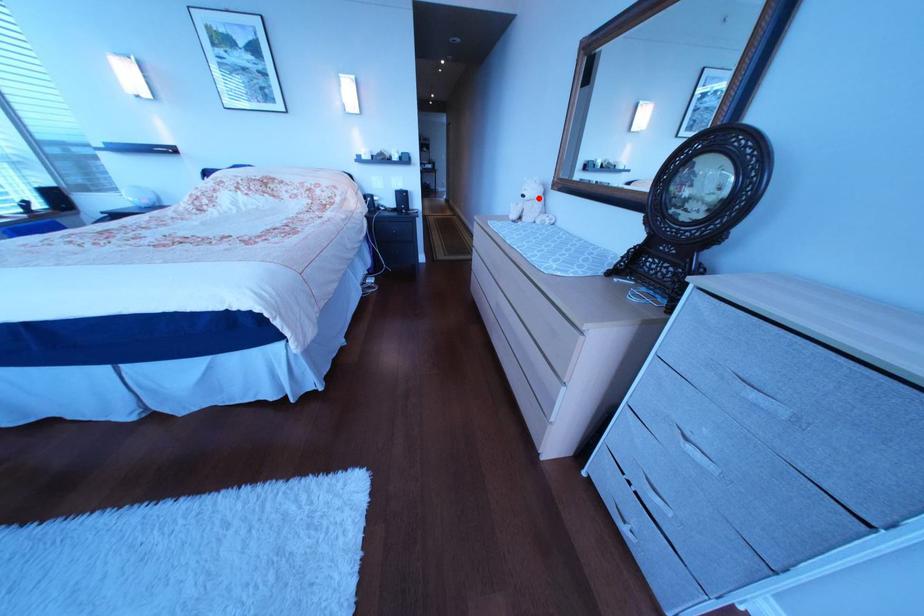
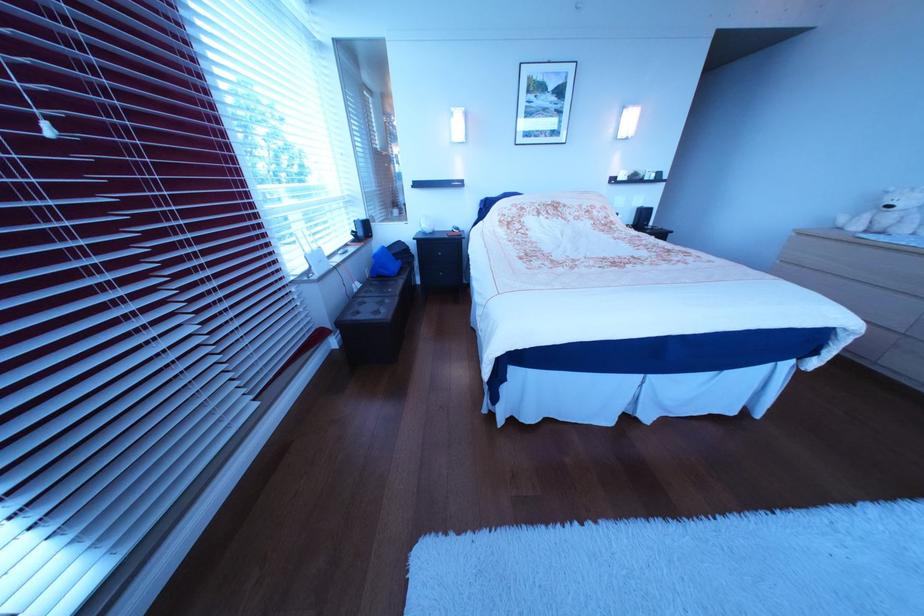
Question: I am providing you with two images of the same scene from different viewpoints. Given a red point in image1, look at the same physical point in image2. Is it:

Choices:
 (A) Closer to the viewpoint
 (B) Farther from the viewpoint

Answer: (B)